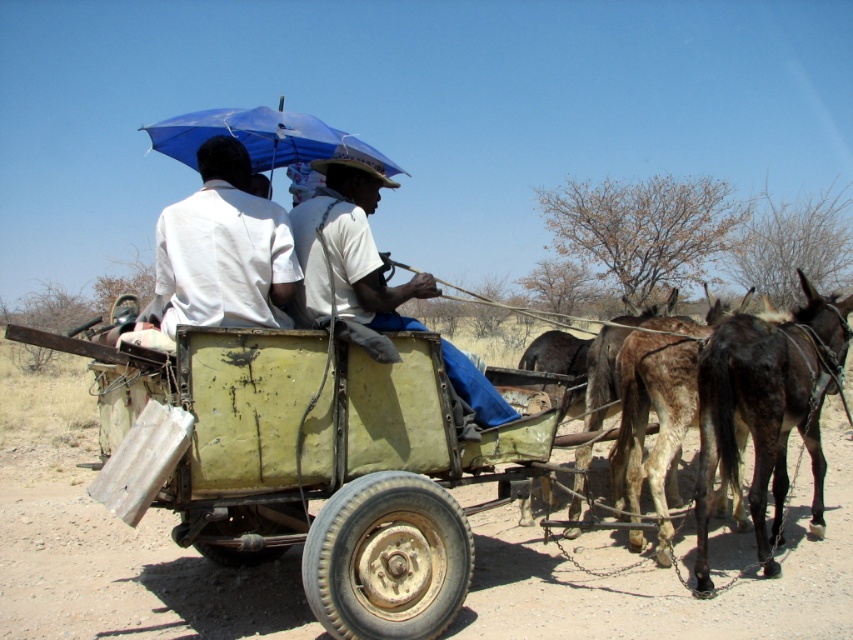
Question: Can you confirm if green painted wood cart at center is smaller than white matte shirt at upper center?

Choices:
 (A) yes
 (B) no

Answer: (B)

Question: Which object appears closest to the camera in this image?

Choices:
 (A) white matte shirt at upper center
 (B) green painted wood cart at center
 (C) blue fabric umbrella at center

Answer: (B)

Question: Based on their relative distances, which object is farther from the white matte shirt at upper center?

Choices:
 (A) dark brown leather mule at right
 (B) green painted wood cart at center
 (C) blue fabric umbrella at center

Answer: (C)

Question: Which point appears closest to the camera in this image?

Choices:
 (A) (364, 241)
 (B) (776, 481)
 (C) (177, 449)

Answer: (C)

Question: Can you confirm if green painted wood cart at center is bigger than white cotton shirt at center?

Choices:
 (A) yes
 (B) no

Answer: (A)

Question: Is green painted wood cart at center closer to camera compared to blue fabric umbrella at center?

Choices:
 (A) yes
 (B) no

Answer: (A)